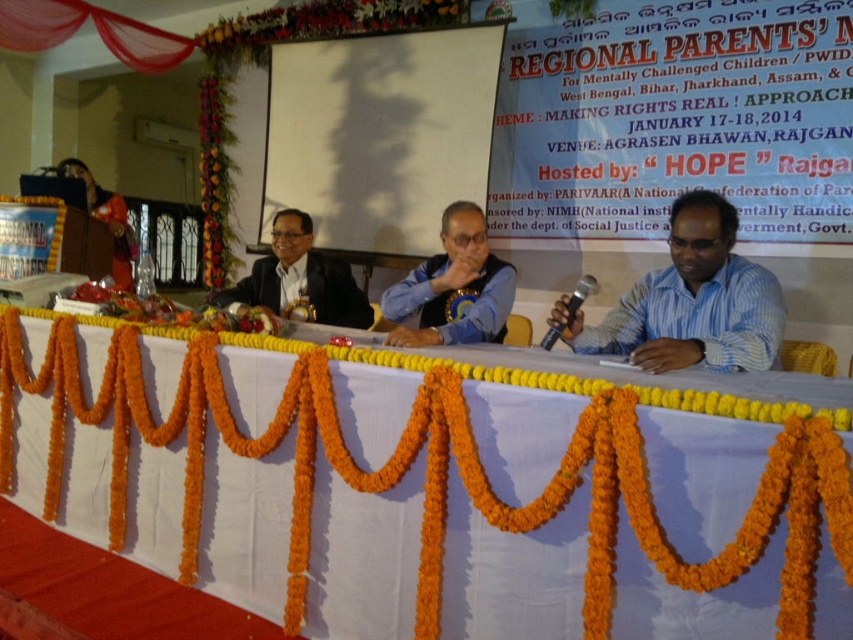
Between white shirt at right and black metallic microphone at center, which one is positioned higher?

black metallic microphone at center is above.

Which is more to the left, white shirt at right or black metallic microphone at center?

Positioned to the left is black metallic microphone at center.

Between point (705, 216) and point (560, 324), which one is positioned behind?

The point (560, 324) is behind.

Where is `white shirt at right`? white shirt at right is located at coordinates (689, 301).

Is white shirt at right to the right of satin black suit at center from the viewer's perspective?

Indeed, white shirt at right is positioned on the right side of satin black suit at center.

Who is positioned more to the left, white shirt at right or satin black suit at center?

Positioned to the left is satin black suit at center.

Is point (718, 236) farther from viewer compared to point (331, 273)?

No, it is not.

Where is `white shirt at right`? The height and width of the screenshot is (640, 853). white shirt at right is located at coordinates (689, 301).

Is satin black suit at center smaller than matte black jacket at left?

Yes.

Is satin black suit at center bigger than matte black jacket at left?

Incorrect, satin black suit at center is not larger than matte black jacket at left.

Between point (294, 285) and point (77, 157), which one is positioned behind?

Point (77, 157)

Identify the location of satin black suit at center. (299, 280).